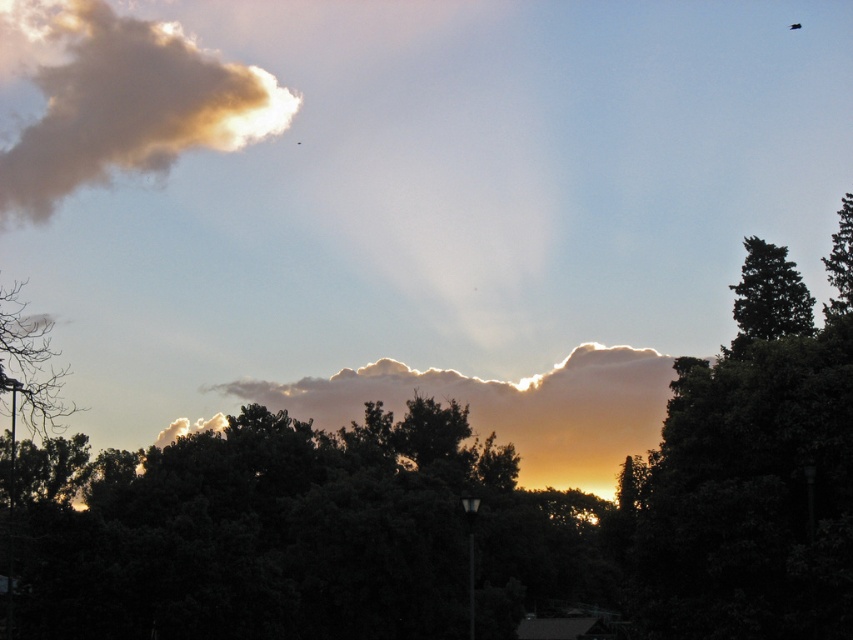
Question: Is golden textured cloud at upper left to the right of bare branches at left from the viewer's perspective?

Choices:
 (A) yes
 (B) no

Answer: (B)

Question: Does bare branches at left have a lesser width compared to green textured tree at right?

Choices:
 (A) yes
 (B) no

Answer: (B)

Question: Is green leafy tree at center below bare branches at left?

Choices:
 (A) yes
 (B) no

Answer: (A)

Question: Which object is farther from the camera taking this photo?

Choices:
 (A) golden textured cloud at upper left
 (B) bare branches at left
 (C) green leafy tree at right

Answer: (A)

Question: Which object appears closest to the camera in this image?

Choices:
 (A) green textured tree at right
 (B) bare branches at left

Answer: (B)

Question: Among these objects, which one is nearest to the camera?

Choices:
 (A) green textured tree at right
 (B) green leafy tree at center
 (C) green leafy tree at right
 (D) bare branches at left

Answer: (D)